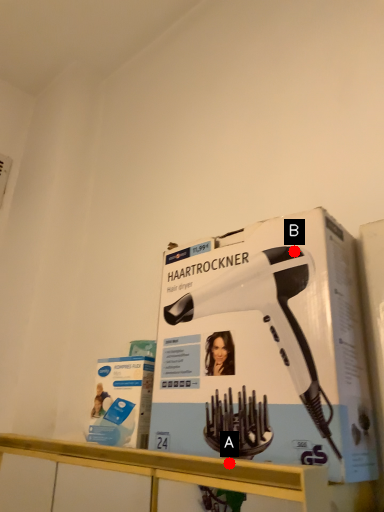
Question: Two points are circled on the image, labeled by A and B beside each circle. Which point is closer to the camera?

Choices:
 (A) A is closer
 (B) B is closer

Answer: (A)